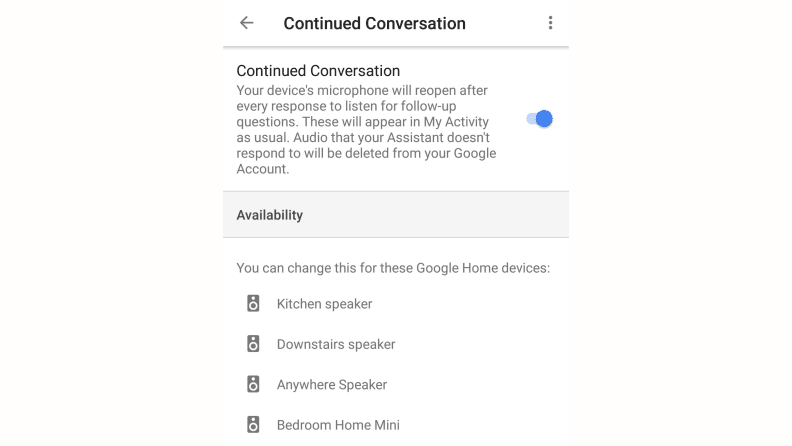
Where is `google home devices`? google home devices is located at coordinates (339, 304), (337, 344), (336, 386), (334, 423).